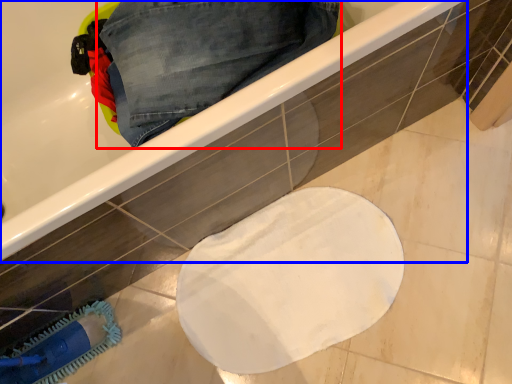
Question: Among these objects, which one is nearest to the camera, trousers (highlighted by a red box) or bathtub (highlighted by a blue box)?

Choices:
 (A) trousers
 (B) bathtub

Answer: (B)